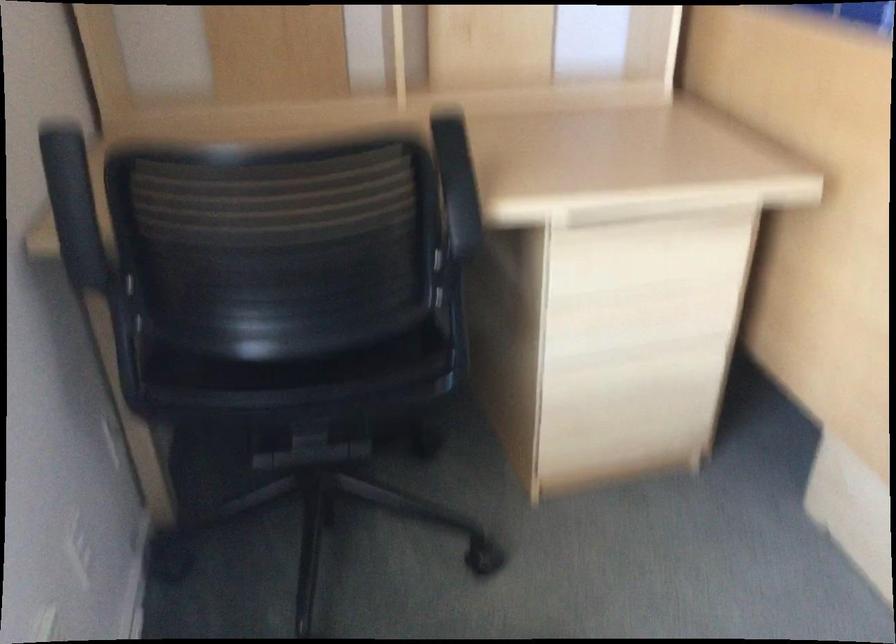
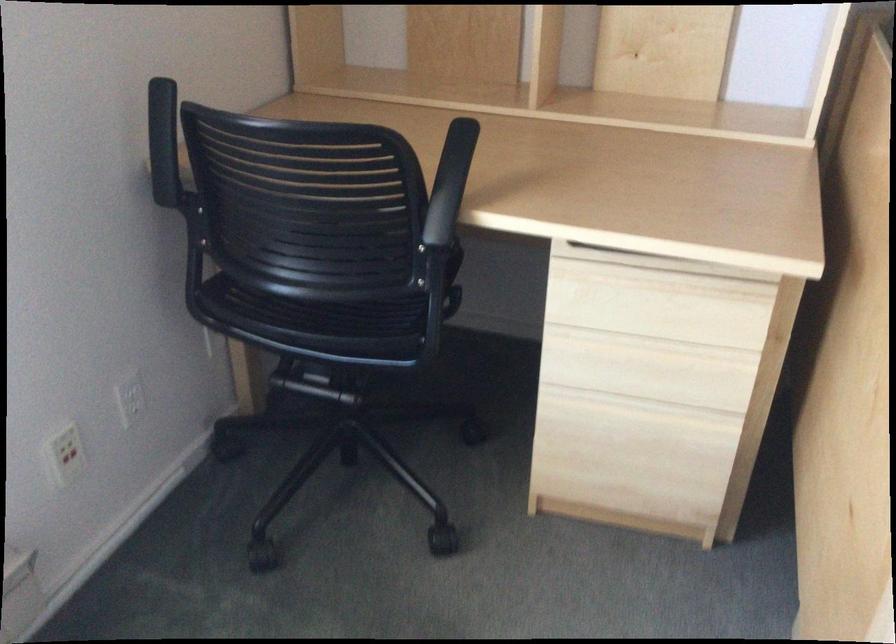
Find the pixel in the second image that matches the point at 627,368 in the first image.

(632, 409)